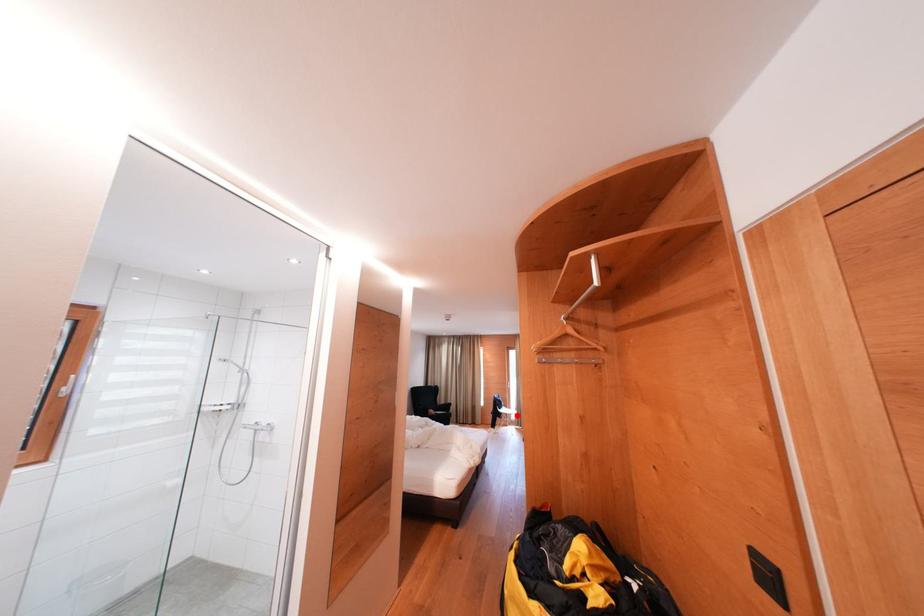
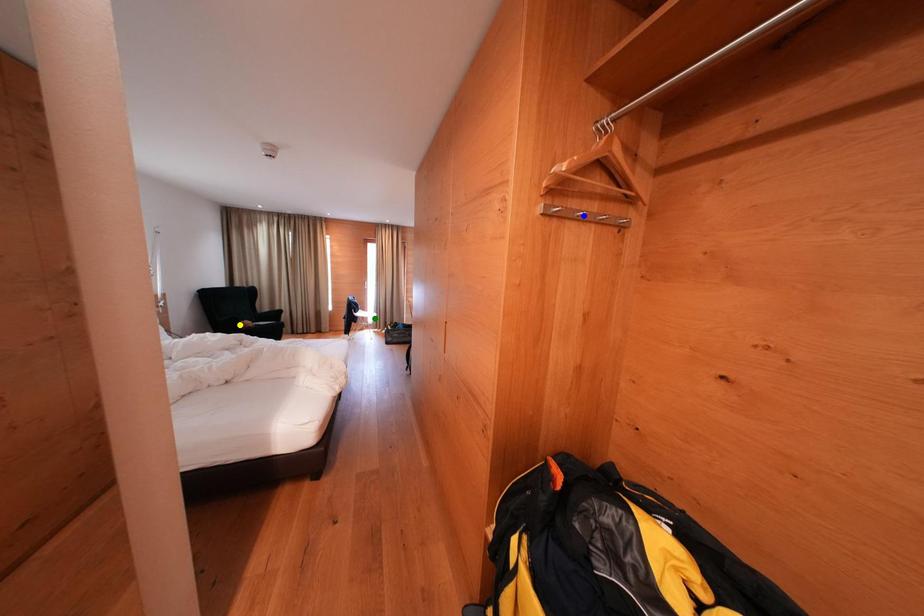
Question: I am providing you with two images of the same scene from different viewpoints. A red point is marked on the first image. You are given multiple points on the second image. Can you choose the point in image 2 that corresponds to the point in image 1?

Choices:
 (A) blue point
 (B) green point
 (C) yellow point

Answer: (B)